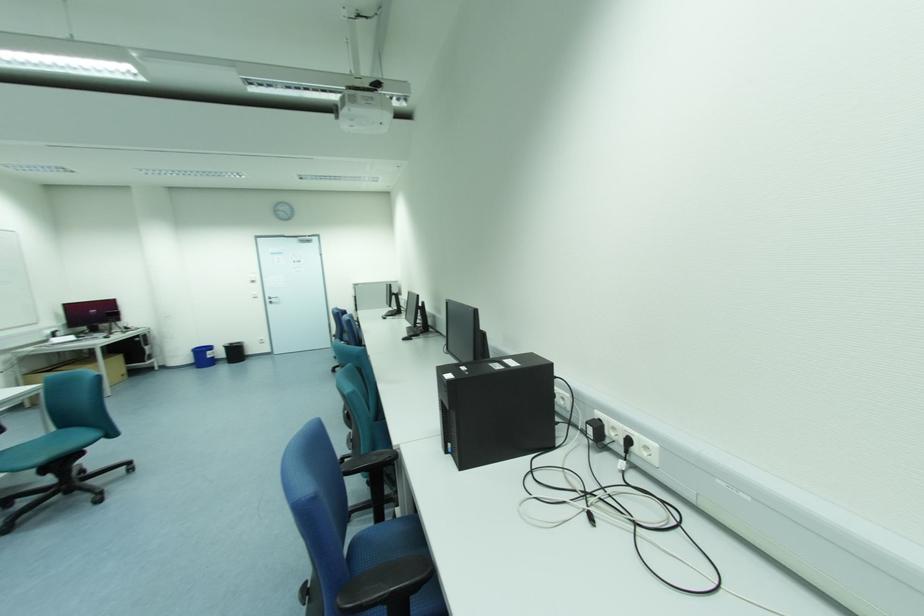
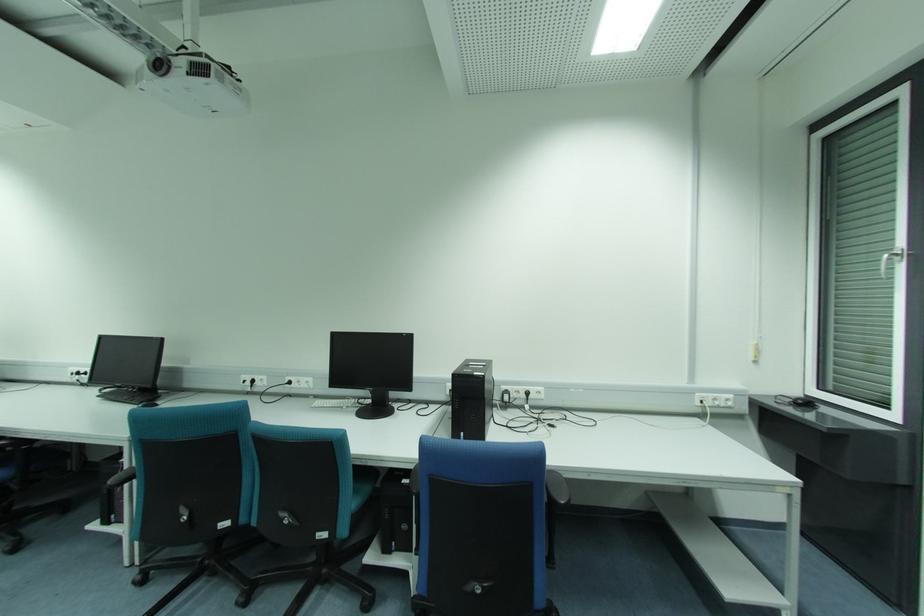
Locate, in the second image, the point that corresponds to point 652,445 in the first image.

(541, 389)